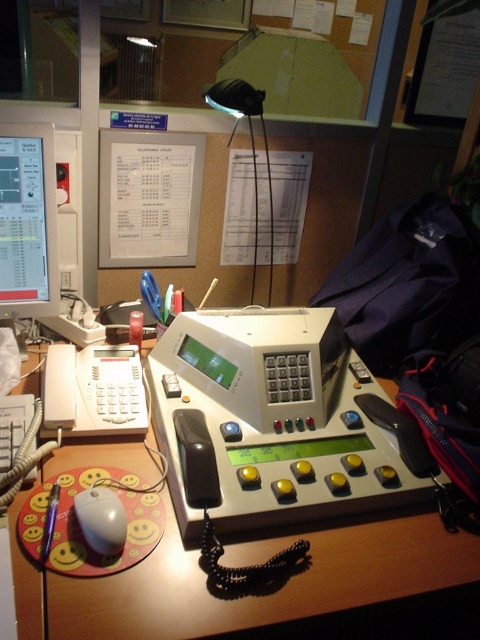
Is black plastic lamp at upper center closer to the viewer compared to white matte mouse at lower left?

No, it is behind white matte mouse at lower left.

Does black plastic lamp at upper center have a greater height compared to white matte mouse at lower left?

Correct, black plastic lamp at upper center is much taller as white matte mouse at lower left.

Looking at this image, who is more forward, (259, 92) or (107, 522)?

Point (107, 522)

Locate an element on the screen. Image resolution: width=480 pixels, height=640 pixels. black plastic lamp at upper center is located at coordinates (251, 147).

Between matte black monitor at upper left and wooden desk at center, which one has more height?

Standing taller between the two is matte black monitor at upper left.

Image resolution: width=480 pixels, height=640 pixels. Describe the element at coordinates (27, 221) in the screenshot. I see `matte black monitor at upper left` at that location.

Where is `matte black monitor at upper left`? Image resolution: width=480 pixels, height=640 pixels. matte black monitor at upper left is located at coordinates (27, 221).

Between point (72, 376) and point (224, 86), which one is positioned behind?

Point (224, 86)

Does white plastic telephone at left appear on the left side of black plastic lamp at upper center?

Yes, white plastic telephone at left is to the left of black plastic lamp at upper center.

Identify the location of white plastic telephone at left. (94, 390).

This screenshot has width=480, height=640. Find the location of `white plastic telephone at left`. white plastic telephone at left is located at coordinates (94, 390).